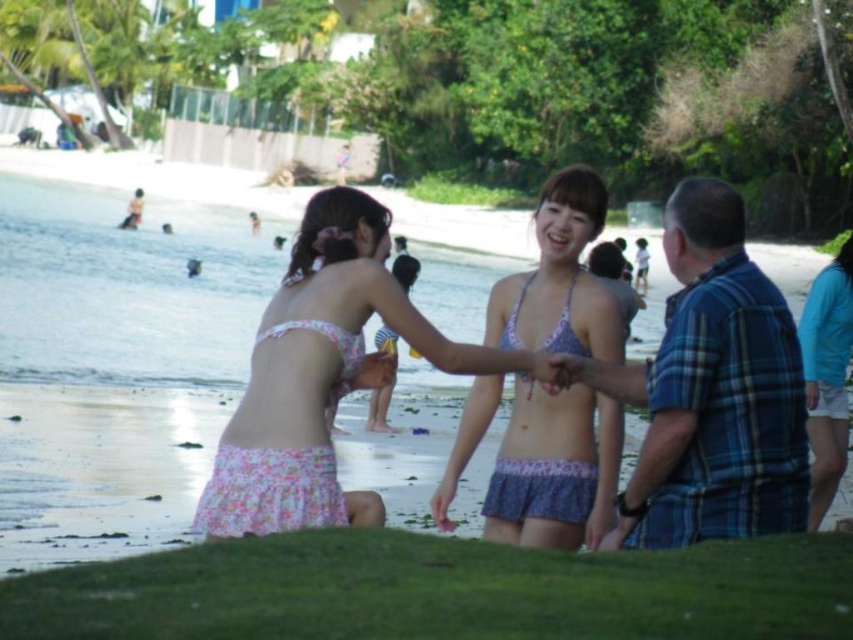
Question: Does floral fabric bikini top at center have a greater width compared to purple printed bikini at center?

Choices:
 (A) no
 (B) yes

Answer: (A)

Question: Which point is closer to the camera taking this photo?

Choices:
 (A) (312, 516)
 (B) (851, 314)
 (C) (585, 483)
 (D) (405, 259)

Answer: (A)

Question: Which point is farther to the camera?

Choices:
 (A) light blue fabric shorts at lower right
 (B) blue plaid shirt at right
 (C) pink floral bikini at center
 (D) purple printed bikini at center

Answer: (C)

Question: Does floral fabric bikini top at center appear under light blue fabric shorts at lower right?

Choices:
 (A) no
 (B) yes

Answer: (A)

Question: Does floral fabric bikini top at center appear on the left side of light blue fabric shorts at lower right?

Choices:
 (A) no
 (B) yes

Answer: (B)

Question: Which point appears closest to the camera in this image?

Choices:
 (A) (386, 394)
 (B) (335, 355)
 (C) (514, 508)

Answer: (B)